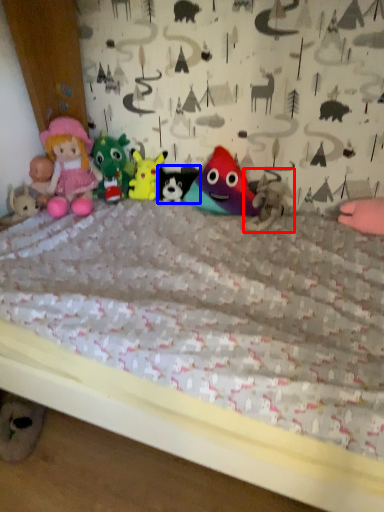
Question: Which object appears farthest to the camera in this image, toy (highlighted by a red box) or toy (highlighted by a blue box)?

Choices:
 (A) toy
 (B) toy

Answer: (B)